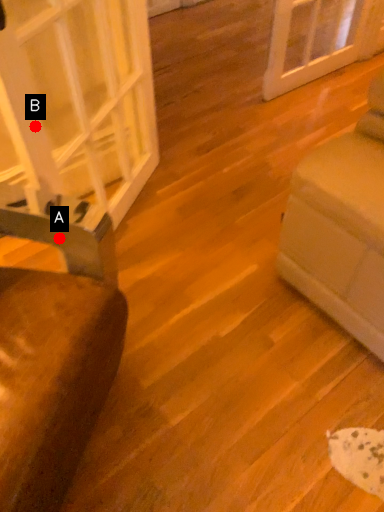
Question: Two points are circled on the image, labeled by A and B beside each circle. Which of the following is the closest to the observer?

Choices:
 (A) A is closer
 (B) B is closer

Answer: (A)